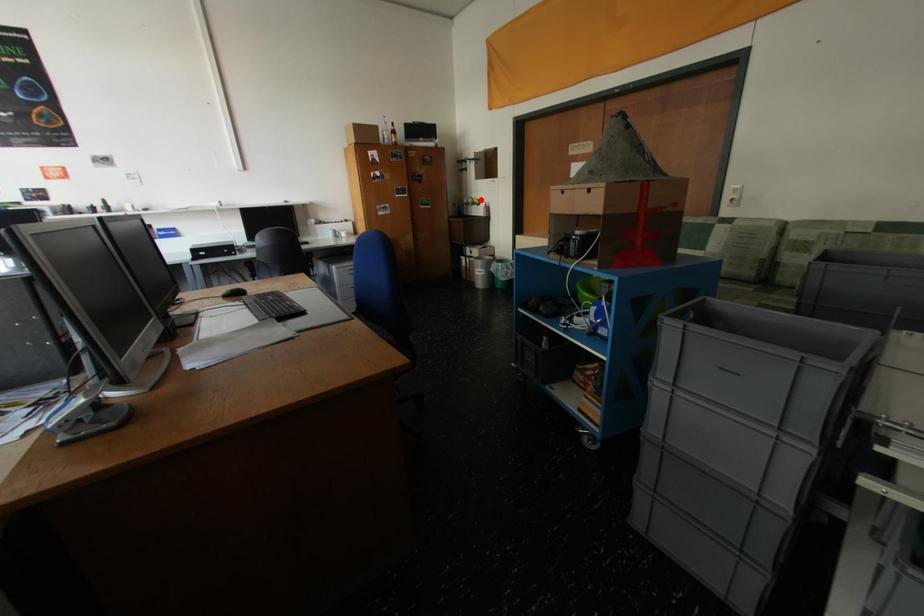
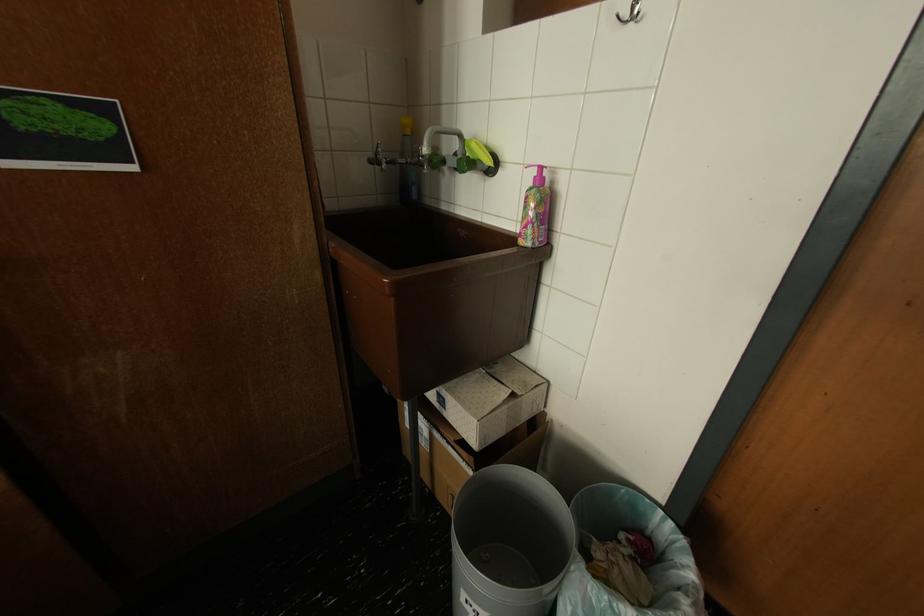
Question: I am providing you with two images of the same scene from different viewpoints. Given a red point in image1, look at the same physical point in image2. Is it:

Choices:
 (A) Closer to the viewpoint
 (B) Farther from the viewpoint

Answer: (B)